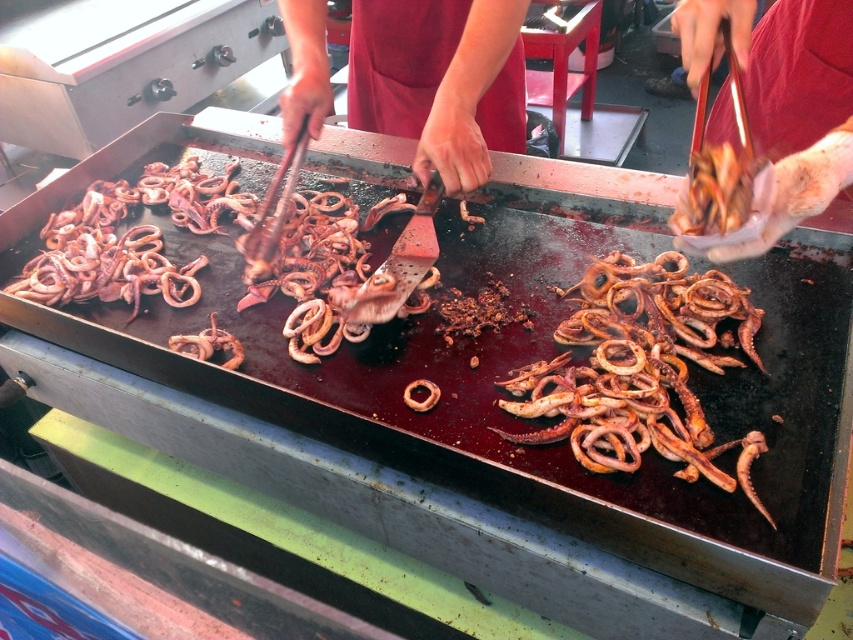
You are a food critic standing at a safe distance of 36 inches from the grill. You want to taste the brown crispy squid at center. Can you reach it without moving closer?

The brown crispy squid at center is 37.34 inches away from the camera, which is slightly farther than your 36 inches safe distance. Therefore, you cannot reach it without moving closer.

You are a food critic evaluating the grilling setup. The brown crispy squid at center and the smooth red apron at center are both in your line of sight. Which object is wider?

The brown crispy squid at center is wider than the smooth red apron at center.

You are a food safety inspector with a measuring tool that can only reach up to 1.5 meters. You need to check the temperature of the squid on the grill. Since you can only measure items within your tool range, can you reach the red apron at center to verify if it is clean?

The red apron at center is 1.45 meters away from the camera, so yes, the inspector can reach it with the tool since it is within the 1.5 meters range.